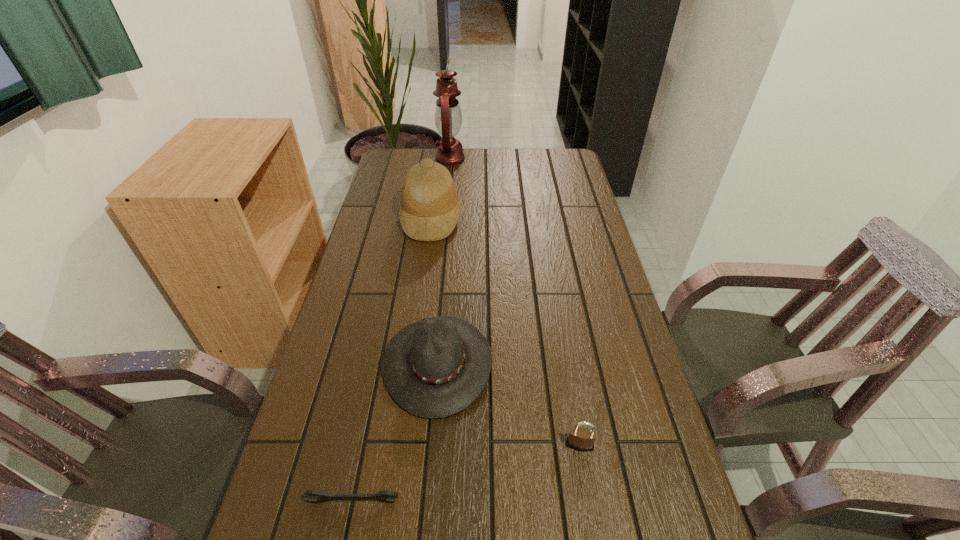
This screenshot has width=960, height=540. What are the coordinates of `vacant region located 0.140m on the left of the oil lamp` in the screenshot? It's located at (402, 158).

Where is `free space located 0.190m on the front-facing side of the taller hat`? This screenshot has height=540, width=960. free space located 0.190m on the front-facing side of the taller hat is located at coordinates (516, 218).

Find the location of a particular element. free space located 0.210m on the front-facing side of the shorter hat is located at coordinates (576, 363).

You are a GUI agent. You are given a task and a screenshot of the screen. Output one action in this format:
    pyautogui.click(x=<x>, y=<y>)
    Task: Click on the free space located 0.050m on the front of the fourth farthest object
    Image resolution: width=960 pixels, height=540 pixels.
    Given the screenshot: What is the action you would take?
    pyautogui.click(x=585, y=476)

Find the location of `object located in the far edge section of the desktop`. object located in the far edge section of the desktop is located at coordinates (448, 118).

At what (x,y) coordinates should I click in order to perform the action: click on hat that is at the left edge. Please return your answer as a coordinate pair (x, y). Looking at the image, I should click on (429, 210).

In order to click on wrench that is at the left edge in this screenshot , I will do `click(386, 496)`.

You are a GUI agent. You are given a task and a screenshot of the screen. Output one action in this format:
    pyautogui.click(x=<x>, y=<y>)
    Task: Click on the object located in the right edge section of the desktop
    The image size is (960, 540).
    Given the screenshot: What is the action you would take?
    pyautogui.click(x=582, y=439)

At what (x,y) coordinates should I click in order to perform the action: click on vacant space at the far edge of the desktop. Please return your answer as a coordinate pair (x, y). The width and height of the screenshot is (960, 540). Looking at the image, I should click on (466, 155).

Image resolution: width=960 pixels, height=540 pixels. What are the coordinates of `vacant region at the left edge of the desktop` in the screenshot? It's located at (404, 239).